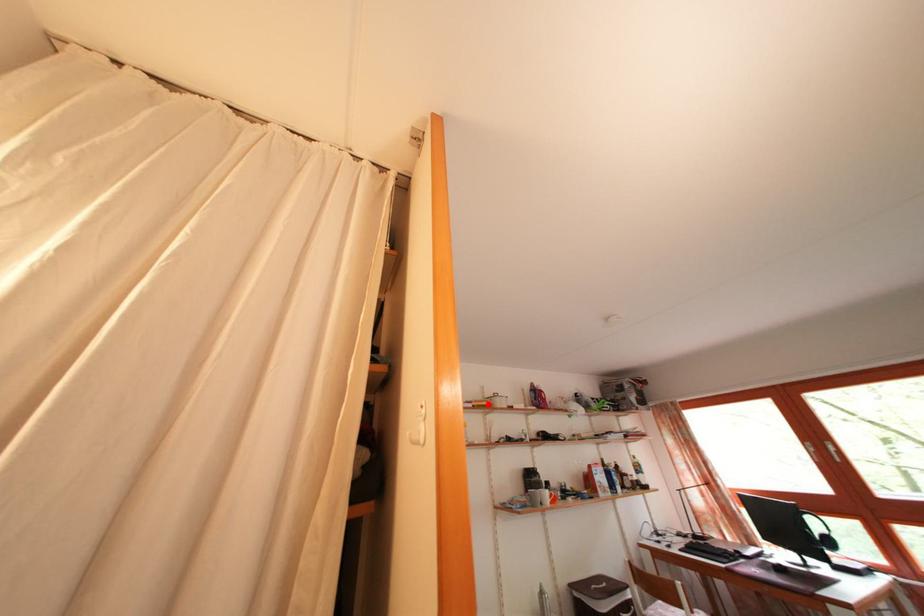
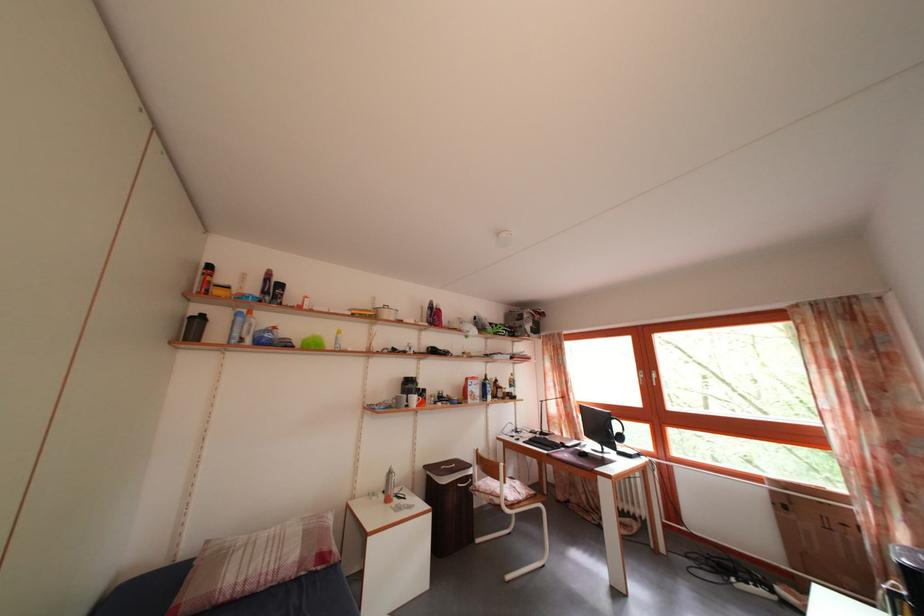
The point at the highlighted location is marked in the first image. Where is the corresponding point in the second image?

(377, 315)